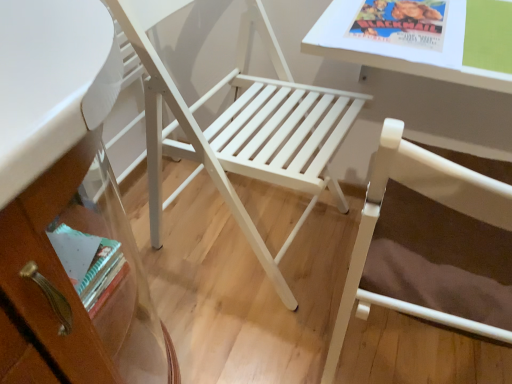
Describe the element at coordinates (432, 199) in the screenshot. I see `white wood chair at center, which is counted as the second chair, starting from the left` at that location.

How much space does white wood chair at center, placed as the first chair when sorted from left to right, occupy horizontally?

21.38 inches.

The height and width of the screenshot is (384, 512). Find the location of `white glossy table at upper right`. white glossy table at upper right is located at coordinates (421, 38).

From the picture: Can you tell me how much white wood chair at center, which is the second chair from right to left, and white wood chair at center, which is counted as the second chair, starting from the left, differ in facing direction?

The angle between the facing direction of white wood chair at center, which is the second chair from right to left, and the facing direction of white wood chair at center, which is counted as the second chair, starting from the left, is 90 degrees.

From the image's perspective, is white wood chair at center, which is the second chair from right to left, beneath white wood chair at center, which ranks as the 1th chair in right-to-left order?

Actually, white wood chair at center, which is the second chair from right to left, appears above white wood chair at center, which ranks as the 1th chair in right-to-left order, in the image.

Considering the sizes of white wood chair at center, which is the second chair from right to left, and white wood chair at center, which ranks as the 1th chair in right-to-left order, in the image, is white wood chair at center, which is the second chair from right to left, taller or shorter than white wood chair at center, which ranks as the 1th chair in right-to-left order,?

white wood chair at center, which is the second chair from right to left, is shorter than white wood chair at center, which ranks as the 1th chair in right-to-left order.

From the picture: Can you confirm if white glossy table at upper right is taller than white wood chair at center, which is the second chair from right to left?

No, white glossy table at upper right is not taller than white wood chair at center, which is the second chair from right to left.

Is white glossy table at upper right to the left of white wood chair at center, placed as the first chair when sorted from left to right, from the viewer's perspective?

No, white glossy table at upper right is not to the left of white wood chair at center, placed as the first chair when sorted from left to right.

Considering the points (460, 75) and (289, 100), which point is in front, point (460, 75) or point (289, 100)?

The point (460, 75) is closer.

Would you say white wood chair at center, placed as the first chair when sorted from left to right, is inside or outside white glossy table at upper right?

white wood chair at center, placed as the first chair when sorted from left to right, is located beyond the bounds of white glossy table at upper right.

Is white glossy table at upper right at the back of white wood chair at center, placed as the first chair when sorted from left to right?

No, white glossy table at upper right is not at the back of white wood chair at center, placed as the first chair when sorted from left to right.

Which is closer to the camera, (159, 162) or (466, 0)?

The point (466, 0) is closer.

Is white wood chair at center, placed as the first chair when sorted from left to right, in front of or behind white glossy table at upper right in the image?

Visually, white wood chair at center, placed as the first chair when sorted from left to right, is located behind white glossy table at upper right.

Is point (485, 87) closer to camera compared to point (343, 299)?

That is True.

Is white glossy table at upper right inside or outside of white wood chair at center, which is counted as the second chair, starting from the left?

white glossy table at upper right exists entirely within white wood chair at center, which is counted as the second chair, starting from the left.

Can you confirm if white glossy table at upper right is smaller than white wood chair at center, which is counted as the second chair, starting from the left?

Yes.

Is white glossy table at upper right touching white wood chair at center, which ranks as the 1th chair in right-to-left order?

No.

Is the depth of white wood chair at center, which is counted as the second chair, starting from the left, less than that of white glossy table at upper right?

Yes, white wood chair at center, which is counted as the second chair, starting from the left, is in front of white glossy table at upper right.

How far apart are white wood chair at center, which ranks as the 1th chair in right-to-left order, and white glossy table at upper right?

The distance of white wood chair at center, which ranks as the 1th chair in right-to-left order, from white glossy table at upper right is 10.98 inches.

Is white wood chair at center, which is counted as the second chair, starting from the left, next to white glossy table at upper right and touching it?

No, white wood chair at center, which is counted as the second chair, starting from the left, is not next to white glossy table at upper right.

Is white wood chair at center, which ranks as the 1th chair in right-to-left order, positioned with its back to white glossy table at upper right?

No, white wood chair at center, which ranks as the 1th chair in right-to-left order, is not facing away from white glossy table at upper right.

Between white wood chair at center, which is counted as the second chair, starting from the left, and white wood chair at center, placed as the first chair when sorted from left to right, which one has smaller width?

With smaller width is white wood chair at center, which is counted as the second chair, starting from the left.

What's the angular difference between white wood chair at center, which ranks as the 1th chair in right-to-left order, and white wood chair at center, which is the second chair from right to left,'s facing directions?

white wood chair at center, which ranks as the 1th chair in right-to-left order, and white wood chair at center, which is the second chair from right to left, are facing 90 degrees away from each other.

Image resolution: width=512 pixels, height=384 pixels. Find the location of `chair that appears in front of the white wood chair at center, placed as the first chair when sorted from left to right`. chair that appears in front of the white wood chair at center, placed as the first chair when sorted from left to right is located at coordinates (432, 199).

Can you confirm if white wood chair at center, which ranks as the 1th chair in right-to-left order, is smaller than white wood chair at center, placed as the first chair when sorted from left to right?

Indeed, white wood chair at center, which ranks as the 1th chair in right-to-left order, has a smaller size compared to white wood chair at center, placed as the first chair when sorted from left to right.

I want to click on chair lying above the white wood chair at center, which is counted as the second chair, starting from the left (from the image's perspective), so click(241, 128).

I want to click on chair behind the white glossy table at upper right, so click(x=241, y=128).

In the scene shown: Estimate the real-world distances between objects in this image. Which object is further from white wood chair at center, which ranks as the 1th chair in right-to-left order, white wood chair at center, placed as the first chair when sorted from left to right, or white glossy table at upper right?

Answer: Among the two, white wood chair at center, placed as the first chair when sorted from left to right, is located further to white wood chair at center, which ranks as the 1th chair in right-to-left order.

Based on their spatial positions, is white wood chair at center, which is counted as the second chair, starting from the left, or white wood chair at center, which is the second chair from right to left, further from white glossy table at upper right?

white wood chair at center, which is the second chair from right to left, is positioned further to the anchor white glossy table at upper right.

Estimate the real-world distances between objects in this image. Which object is further from white wood chair at center, which ranks as the 1th chair in right-to-left order, white glossy table at upper right or white wood chair at center, which is the second chair from right to left?

The object further to white wood chair at center, which ranks as the 1th chair in right-to-left order, is white wood chair at center, which is the second chair from right to left.

Looking at the image, which one is located closer to white glossy table at upper right, white wood chair at center, which is the second chair from right to left, or white wood chair at center, which ranks as the 1th chair in right-to-left order?

Among the two, white wood chair at center, which ranks as the 1th chair in right-to-left order, is located nearer to white glossy table at upper right.

Estimate the real-world distances between objects in this image. Which object is further from white wood chair at center, which is the second chair from right to left, white wood chair at center, which ranks as the 1th chair in right-to-left order, or white glossy table at upper right?

The object further to white wood chair at center, which is the second chair from right to left, is white wood chair at center, which ranks as the 1th chair in right-to-left order.

Based on their spatial positions, is white glossy table at upper right or white wood chair at center, which ranks as the 1th chair in right-to-left order, closer to white wood chair at center, placed as the first chair when sorted from left to right?

The object closer to white wood chair at center, placed as the first chair when sorted from left to right, is white glossy table at upper right.

At what (x,y) coordinates should I click in order to perform the action: click on chair located between white wood chair at center, which is the second chair from right to left, and white glossy table at upper right in the left-right direction. Please return your answer as a coordinate pair (x, y). This screenshot has width=512, height=384. Looking at the image, I should click on (432, 199).